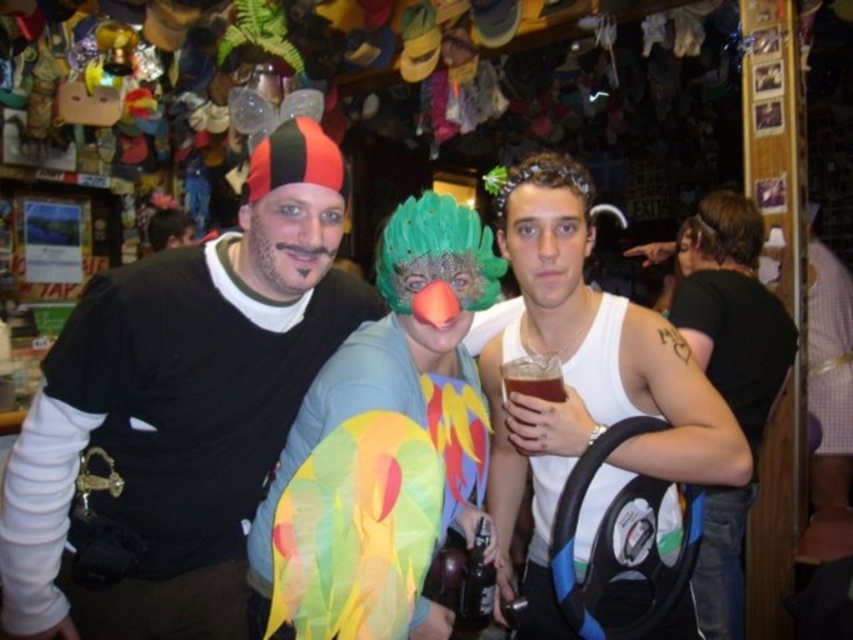
You are a photographer trying to capture a clear shot of the multicolored fabric parrot at center and the green feathered wig at center. Since both are at the center, which one should you focus on first to ensure the taller object is in focus?

The multicolored fabric parrot at center is taller than the green feathered wig at center, so you should focus on the multicolored fabric parrot at center first to ensure it is in focus.

You are a photographer at this themed bar event. You need to ensure that all props fit into a rectangular storage box that can only accommodate items up to the size of the green feathered wig at center. Can the black matte shirt at center be stored in this box?

The black matte shirt at center is larger in size than the green feathered wig at center, so it cannot fit into the storage box designed for items up to the size of the green feathered wig at center.